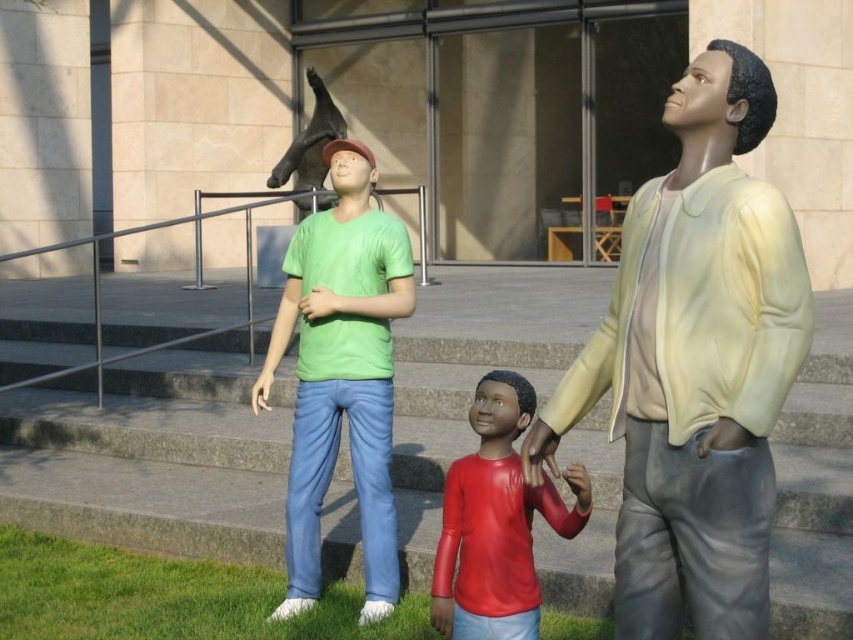
Question: Is rubberized red shirt at center closer to the viewer compared to matte red hand at center?

Choices:
 (A) no
 (B) yes

Answer: (A)

Question: Which point is closer to the camera?

Choices:
 (A) matte green t-shirt at center
 (B) matte red hand at lower center
 (C) gray concrete stairs at center

Answer: (B)

Question: Does matte yellow jacket at center lie in front of matte green t-shirt at center?

Choices:
 (A) yes
 (B) no

Answer: (A)

Question: Based on their relative distances, which object is farther from the matte red hand at center?

Choices:
 (A) matte green t-shirt at center
 (B) matte yellow jacket at center
 (C) rubberized red shirt at center

Answer: (A)

Question: Can you confirm if matte yellow jacket at center is positioned below matte green t-shirt at center?

Choices:
 (A) yes
 (B) no

Answer: (B)

Question: Which point is farther from the camera taking this photo?

Choices:
 (A) (274, 452)
 (B) (309, 209)
 (C) (456, 513)

Answer: (B)